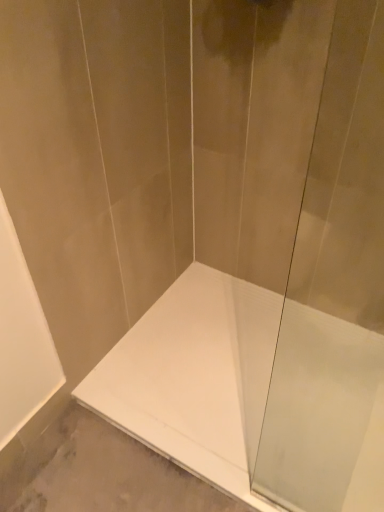
Question: In the image, is transparent glass shower door at center on the left side or the right side of white glossy bathtub at center?

Choices:
 (A) right
 (B) left

Answer: (A)

Question: From a real-world perspective, is transparent glass shower door at center positioned above or below white glossy bathtub at center?

Choices:
 (A) above
 (B) below

Answer: (A)

Question: Considering the positions of transparent glass shower door at center and white glossy bathtub at center in the image, is transparent glass shower door at center taller or shorter than white glossy bathtub at center?

Choices:
 (A) short
 (B) tall

Answer: (B)

Question: Considering the positions of white glossy bathtub at center and transparent glass shower door at center in the image, is white glossy bathtub at center wider or thinner than transparent glass shower door at center?

Choices:
 (A) wide
 (B) thin

Answer: (A)

Question: Considering the positions of white glossy bathtub at center and transparent glass shower door at center in the image, is white glossy bathtub at center taller or shorter than transparent glass shower door at center?

Choices:
 (A) short
 (B) tall

Answer: (A)

Question: Based on their sizes in the image, would you say white glossy bathtub at center is bigger or smaller than transparent glass shower door at center?

Choices:
 (A) small
 (B) big

Answer: (B)

Question: From a real-world perspective, relative to transparent glass shower door at center, is white glossy bathtub at center vertically above or below?

Choices:
 (A) below
 (B) above

Answer: (A)